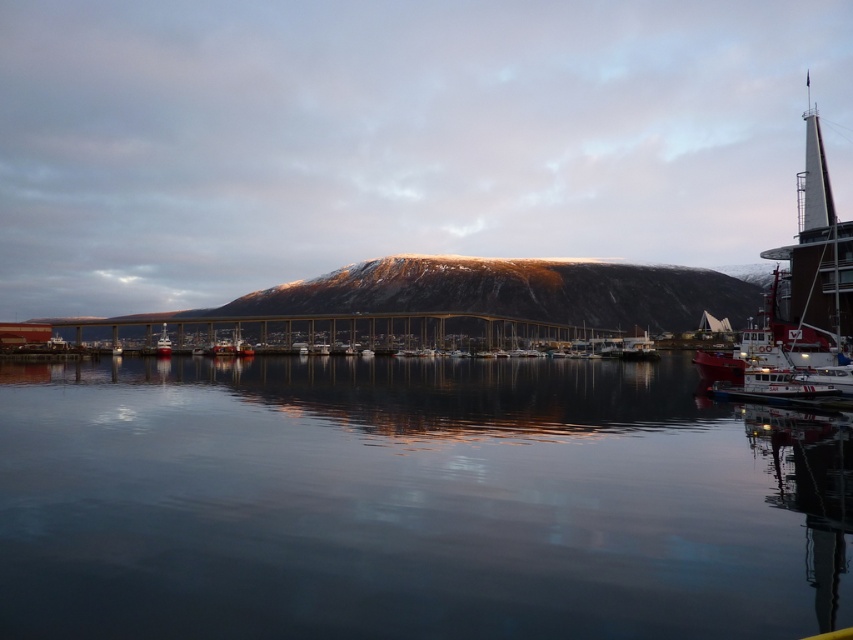
You are a photographer planning to capture the harbor scene. You want to ensure that the sandy brown rock at center and the white glossy boat at lower left are both visible in your shot. Given their heights, which object will appear taller in the photograph?

The sandy brown rock at center will appear taller in the photograph since it has a greater height compared to the white glossy boat at lower left according to the description.

You are a photographer taking a picture of the harbor scene. You want to ensure that both the smooth dark water at center and the shiny red boat at lower left are clearly visible in your shot. Based on their positions, which object should appear closer to the camera in the final photograph?

The smooth dark water at center appears closer to the camera because it is positioned in front of the shiny red boat at lower left.